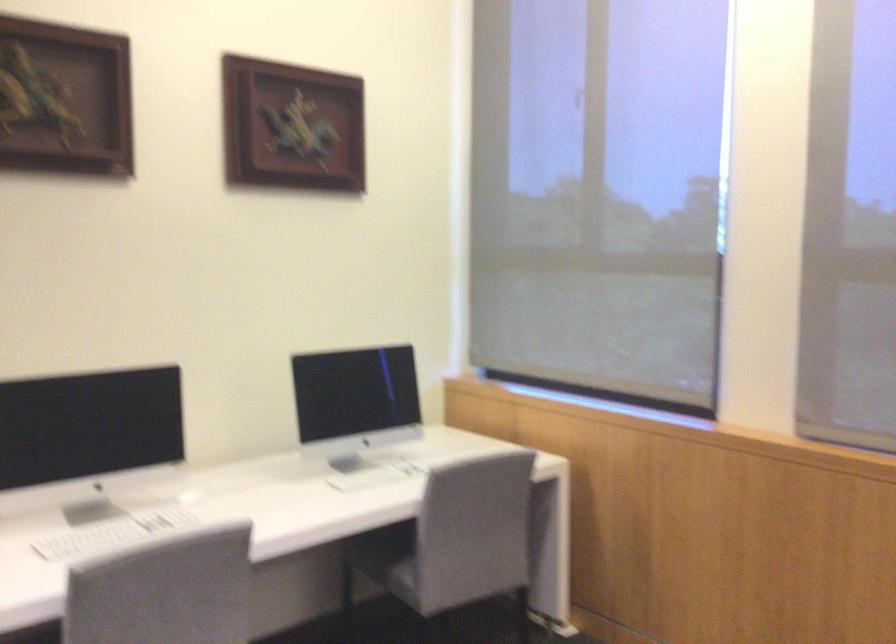
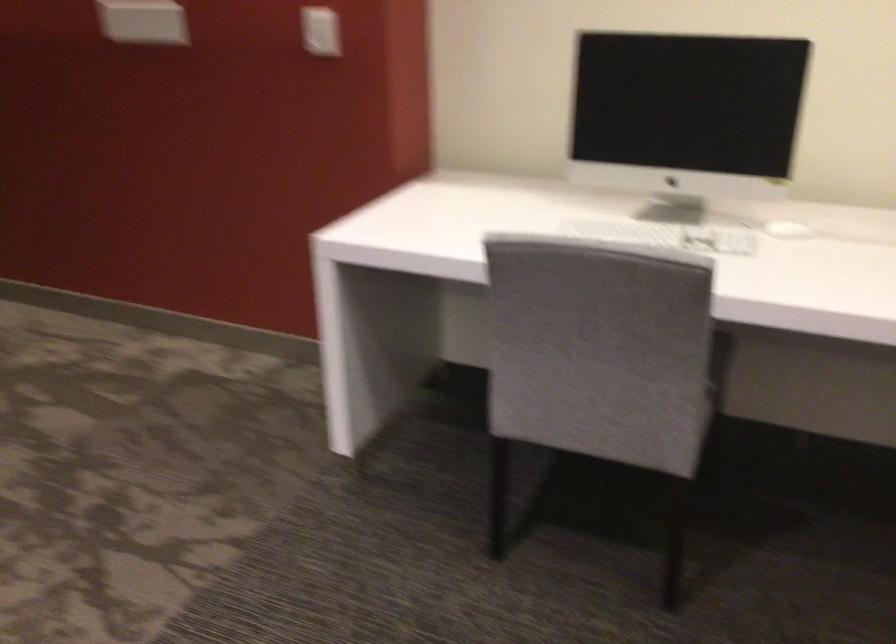
In the second image, find the point that corresponds to (x=135, y=527) in the first image.

(666, 234)